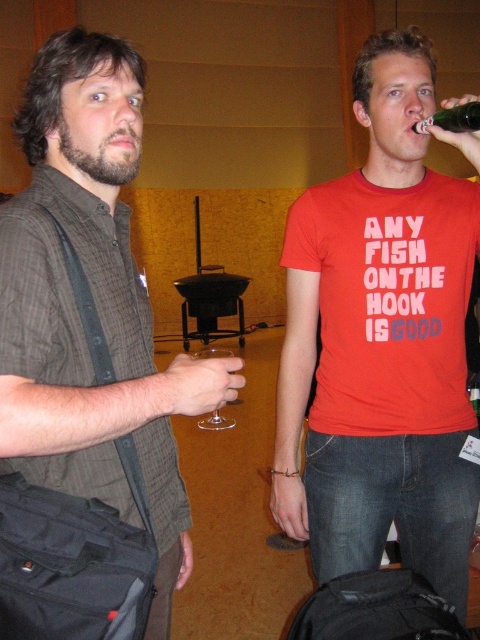
You are at a party and want to choose a drink. You see a clear glass wine at upper right and a transparent glass at center. Which one is taller?

The clear glass wine at upper right is much taller than the transparent glass at center.